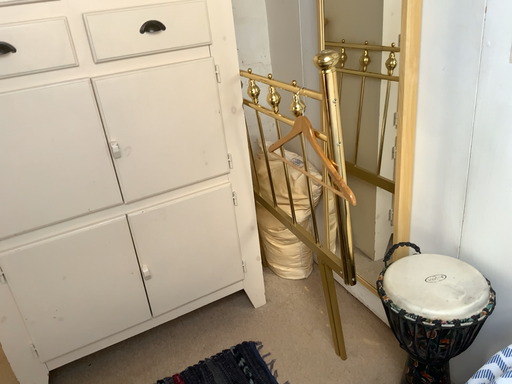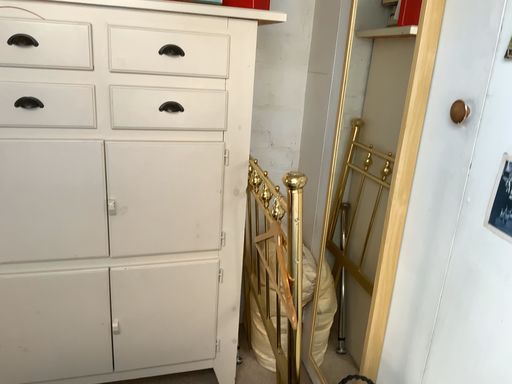
Question: How did the camera likely rotate when shooting the video?

Choices:
 (A) rotated downward
 (B) rotated upward

Answer: (B)